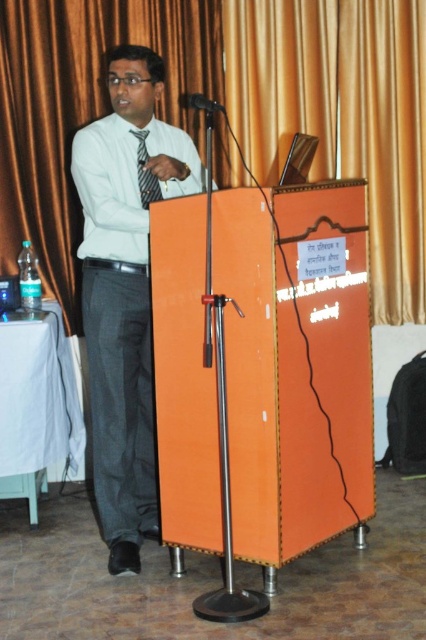
Question: Does matte white shirt at center have a smaller size compared to striped fabric tie at center?

Choices:
 (A) no
 (B) yes

Answer: (A)

Question: Which point is closer to the camera?

Choices:
 (A) 181,32
 (B) 141,160

Answer: (B)

Question: Which of the following is the farthest from the observer?

Choices:
 (A) gold fabric curtain at upper center
 (B) white glossy dress shirt at center

Answer: (A)

Question: Does gold fabric curtain at upper center have a greater width compared to white glossy dress shirt at center?

Choices:
 (A) yes
 (B) no

Answer: (A)

Question: Does white glossy dress shirt at center appear under striped fabric tie at center?

Choices:
 (A) yes
 (B) no

Answer: (A)

Question: Which of the following is the farthest from the observer?

Choices:
 (A) (83, 316)
 (B) (13, 76)
 (C) (221, 104)
 (D) (275, 147)

Answer: (D)